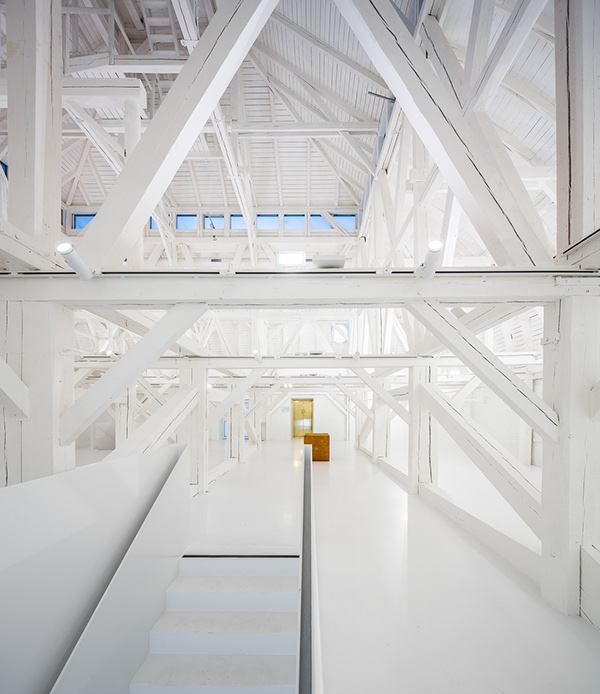
At what (x,y) coordinates should I click in order to perform the action: click on box. Please return your answer as a coordinate pair (x, y). Looking at the image, I should click on (321, 439).